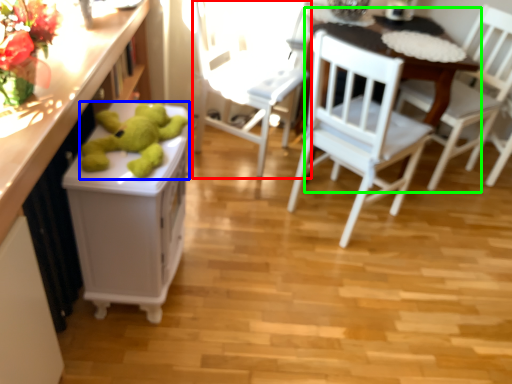
Question: Which object is positioned farthest from chair (highlighted by a red box)? Select from toy (highlighted by a blue box) and table (highlighted by a green box).

Choices:
 (A) toy
 (B) table

Answer: (A)